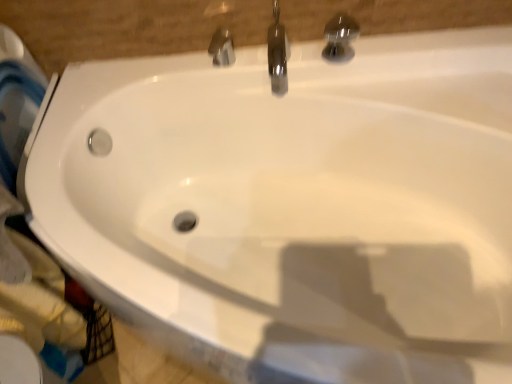
What do you see at coordinates (340, 38) in the screenshot? I see `polished chrome tap at upper center, the first tap positioned from the right` at bounding box center [340, 38].

Where is `polished chrome faucet at upper center, which ranks as the first tap in left-to-right order`? This screenshot has width=512, height=384. polished chrome faucet at upper center, which ranks as the first tap in left-to-right order is located at coordinates (222, 47).

Where is `polished chrome faucet at upper center, which is the second tap from right to left`? This screenshot has height=384, width=512. polished chrome faucet at upper center, which is the second tap from right to left is located at coordinates (278, 53).

In the scene shown: Can polished chrome faucet at upper center, which ranks as the 3th tap in right-to-left order, be found inside polished chrome faucet at upper center, which is the second tap from right to left?

No, polished chrome faucet at upper center, which is the second tap from right to left, does not contain polished chrome faucet at upper center, which ranks as the 3th tap in right-to-left order.

Consider the image. From the image's perspective, does polished chrome faucet at upper center, which is the second tap from right to left, appear lower than polished chrome faucet at upper center, which ranks as the first tap in left-to-right order?

No, from the image's perspective, polished chrome faucet at upper center, which is the second tap from right to left, is not beneath polished chrome faucet at upper center, which ranks as the first tap in left-to-right order.

How much distance is there between polished chrome faucet at upper center, which is counted as the second tap, starting from the left, and polished chrome faucet at upper center, which ranks as the first tap in left-to-right order?

5.44 inches.

Is polished chrome tap at upper center, the third tap when ordered from left to right, completely or partially outside of polished chrome faucet at upper center, which ranks as the 3th tap in right-to-left order?

Absolutely, polished chrome tap at upper center, the third tap when ordered from left to right, is external to polished chrome faucet at upper center, which ranks as the 3th tap in right-to-left order.

How different are the orientations of polished chrome tap at upper center, the first tap positioned from the right, and polished chrome faucet at upper center, which ranks as the first tap in left-to-right order, in degrees?

1.54 degrees.

Is polished chrome tap at upper center, the third tap when ordered from left to right, bigger or smaller than polished chrome faucet at upper center, which ranks as the first tap in left-to-right order?

Considering their sizes, polished chrome tap at upper center, the third tap when ordered from left to right, takes up more space than polished chrome faucet at upper center, which ranks as the first tap in left-to-right order.

From the image's perspective, which one is positioned higher, polished chrome tap at upper center, the first tap positioned from the right, or polished chrome faucet at upper center, which ranks as the first tap in left-to-right order?

polished chrome tap at upper center, the first tap positioned from the right.

Where is `the 2nd tap behind the polished chrome tap at upper center, the first tap positioned from the right, counting from the anchor's position`? This screenshot has height=384, width=512. the 2nd tap behind the polished chrome tap at upper center, the first tap positioned from the right, counting from the anchor's position is located at coordinates (222, 47).

From their relative heights in the image, would you say polished chrome faucet at upper center, which ranks as the first tap in left-to-right order, is taller or shorter than polished chrome tap at upper center, the first tap positioned from the right?

polished chrome faucet at upper center, which ranks as the first tap in left-to-right order, is shorter than polished chrome tap at upper center, the first tap positioned from the right.

From a real-world perspective, is polished chrome faucet at upper center, which ranks as the 3th tap in right-to-left order, physically located above or below polished chrome tap at upper center, the first tap positioned from the right?

From a real-world perspective, polished chrome faucet at upper center, which ranks as the 3th tap in right-to-left order, is physically below polished chrome tap at upper center, the first tap positioned from the right.

Looking at the image, does polished chrome faucet at upper center, which ranks as the 3th tap in right-to-left order, seem bigger or smaller compared to polished chrome tap at upper center, the first tap positioned from the right?

In the image, polished chrome faucet at upper center, which ranks as the 3th tap in right-to-left order, appears to be smaller than polished chrome tap at upper center, the first tap positioned from the right.

Can you confirm if polished chrome faucet at upper center, which ranks as the first tap in left-to-right order, is wider than polished chrome faucet at upper center, which is the second tap from right to left?

No, polished chrome faucet at upper center, which ranks as the first tap in left-to-right order, is not wider than polished chrome faucet at upper center, which is the second tap from right to left.

In the image, is polished chrome faucet at upper center, which ranks as the first tap in left-to-right order, on the left side or the right side of polished chrome faucet at upper center, which is the second tap from right to left?

Clearly, polished chrome faucet at upper center, which ranks as the first tap in left-to-right order, is on the left of polished chrome faucet at upper center, which is the second tap from right to left, in the image.

Considering the sizes of objects polished chrome faucet at upper center, which ranks as the first tap in left-to-right order, and polished chrome faucet at upper center, which is the second tap from right to left, in the image provided, who is bigger, polished chrome faucet at upper center, which ranks as the first tap in left-to-right order, or polished chrome faucet at upper center, which is the second tap from right to left,?

polished chrome faucet at upper center, which is the second tap from right to left.

Is polished chrome faucet at upper center, which ranks as the first tap in left-to-right order, with polished chrome faucet at upper center, which is counted as the second tap, starting from the left?

polished chrome faucet at upper center, which ranks as the first tap in left-to-right order, and polished chrome faucet at upper center, which is counted as the second tap, starting from the left, are clearly separated.

How much distance is there between polished chrome tap at upper center, the first tap positioned from the right, and polished chrome faucet at upper center, which is the second tap from right to left?

They are 5.77 inches apart.

Looking at this image, is polished chrome tap at upper center, the first tap positioned from the right, looking in the opposite direction of polished chrome faucet at upper center, which is the second tap from right to left?

No.

In terms of width, does polished chrome tap at upper center, the first tap positioned from the right, look wider or thinner when compared to polished chrome faucet at upper center, which is counted as the second tap, starting from the left?

Considering their sizes, polished chrome tap at upper center, the first tap positioned from the right, looks slimmer than polished chrome faucet at upper center, which is counted as the second tap, starting from the left.

From the image's perspective, is polished chrome tap at upper center, the third tap when ordered from left to right, above polished chrome faucet at upper center, which is counted as the second tap, starting from the left?

No, from the image's perspective, polished chrome tap at upper center, the third tap when ordered from left to right, is not over polished chrome faucet at upper center, which is counted as the second tap, starting from the left.

From the image's perspective, is polished chrome faucet at upper center, which is the second tap from right to left, located above or below polished chrome tap at upper center, the first tap positioned from the right?

Clearly, from the image's perspective, polished chrome faucet at upper center, which is the second tap from right to left, is above polished chrome tap at upper center, the first tap positioned from the right.

In terms of width, does polished chrome faucet at upper center, which is counted as the second tap, starting from the left, look wider or thinner when compared to polished chrome tap at upper center, the first tap positioned from the right?

In the image, polished chrome faucet at upper center, which is counted as the second tap, starting from the left, appears to be wider than polished chrome tap at upper center, the first tap positioned from the right.

Is point (275, 54) positioned after point (335, 37)?

That is True.

There is a polished chrome tap at upper center, the third tap when ordered from left to right. Identify the location of the 1st tap below it (from a real-world perspective). This screenshot has height=384, width=512. (278, 53).

The width and height of the screenshot is (512, 384). I want to click on the 1st tap in front when counting from the polished chrome faucet at upper center, which ranks as the 3th tap in right-to-left order, so click(278, 53).

From a real-world perspective, count 2nd taps downward from the polished chrome tap at upper center, the third tap when ordered from left to right, and point to it. Please provide its 2D coordinates.

[(222, 47)]

Looking at this image, which object lies further to the anchor point polished chrome faucet at upper center, which is the second tap from right to left, polished chrome tap at upper center, the third tap when ordered from left to right, or polished chrome faucet at upper center, which ranks as the 3th tap in right-to-left order?

polished chrome tap at upper center, the third tap when ordered from left to right, is further to polished chrome faucet at upper center, which is the second tap from right to left.

From the image, which object appears to be nearer to polished chrome tap at upper center, the third tap when ordered from left to right, polished chrome faucet at upper center, which is the second tap from right to left, or polished chrome faucet at upper center, which ranks as the first tap in left-to-right order?

polished chrome faucet at upper center, which is the second tap from right to left, is positioned closer to the anchor polished chrome tap at upper center, the third tap when ordered from left to right.

Which object lies nearer to the anchor point polished chrome faucet at upper center, which ranks as the 3th tap in right-to-left order, polished chrome faucet at upper center, which is counted as the second tap, starting from the left, or polished chrome tap at upper center, the third tap when ordered from left to right?

polished chrome faucet at upper center, which is counted as the second tap, starting from the left, lies closer to polished chrome faucet at upper center, which ranks as the 3th tap in right-to-left order, than the other object.

Based on their spatial positions, is polished chrome tap at upper center, the first tap positioned from the right, or polished chrome faucet at upper center, which is the second tap from right to left, further from polished chrome faucet at upper center, which ranks as the first tap in left-to-right order?

polished chrome tap at upper center, the first tap positioned from the right, lies further to polished chrome faucet at upper center, which ranks as the first tap in left-to-right order, than the other object.

Based on their spatial positions, is polished chrome faucet at upper center, which ranks as the first tap in left-to-right order, or polished chrome tap at upper center, the third tap when ordered from left to right, further from polished chrome faucet at upper center, which is counted as the second tap, starting from the left?

The object further to polished chrome faucet at upper center, which is counted as the second tap, starting from the left, is polished chrome tap at upper center, the third tap when ordered from left to right.

When comparing their distances from polished chrome tap at upper center, the first tap positioned from the right, does polished chrome faucet at upper center, which ranks as the first tap in left-to-right order, or polished chrome faucet at upper center, which is the second tap from right to left, seem further?

Among the two, polished chrome faucet at upper center, which ranks as the first tap in left-to-right order, is located further to polished chrome tap at upper center, the first tap positioned from the right.

Identify the location of tap between polished chrome faucet at upper center, which ranks as the 3th tap in right-to-left order, and polished chrome tap at upper center, the third tap when ordered from left to right, in the horizontal direction. (278, 53).